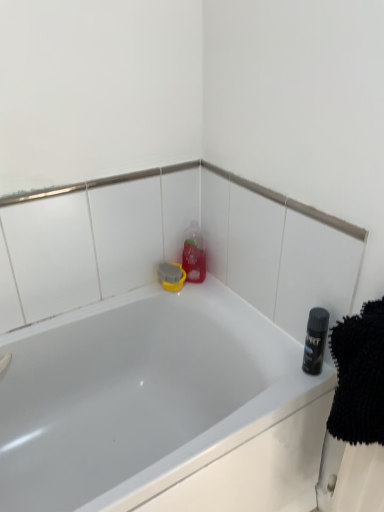
Question: Is shiny black can at right in contact with translucent plastic bottle at upper center?

Choices:
 (A) yes
 (B) no

Answer: (B)

Question: From a real-world perspective, is shiny black can at right over translucent plastic bottle at upper center?

Choices:
 (A) no
 (B) yes

Answer: (A)

Question: Is shiny black can at right smaller than translucent plastic bottle at upper center?

Choices:
 (A) no
 (B) yes

Answer: (B)

Question: From the image's perspective, is shiny black can at right beneath translucent plastic bottle at upper center?

Choices:
 (A) yes
 (B) no

Answer: (A)

Question: Is shiny black can at right facing towards translucent plastic bottle at upper center?

Choices:
 (A) yes
 (B) no

Answer: (B)

Question: From the image's perspective, is white glossy bathtub at center positioned above or below shiny black can at right?

Choices:
 (A) above
 (B) below

Answer: (B)

Question: Is white glossy bathtub at center to the left or to the right of shiny black can at right in the image?

Choices:
 (A) left
 (B) right

Answer: (A)

Question: Relative to shiny black can at right, is white glossy bathtub at center in front or behind?

Choices:
 (A) front
 (B) behind

Answer: (A)

Question: From their relative heights in the image, would you say white glossy bathtub at center is taller or shorter than shiny black can at right?

Choices:
 (A) short
 (B) tall

Answer: (B)

Question: Considering the positions of translucent plastic bottle at upper center and white glossy bathtub at center in the image, is translucent plastic bottle at upper center bigger or smaller than white glossy bathtub at center?

Choices:
 (A) big
 (B) small

Answer: (B)

Question: Looking at their shapes, would you say translucent plastic bottle at upper center is wider or thinner than white glossy bathtub at center?

Choices:
 (A) wide
 (B) thin

Answer: (B)

Question: Based on their positions, is translucent plastic bottle at upper center located to the left or right of white glossy bathtub at center?

Choices:
 (A) left
 (B) right

Answer: (B)

Question: Does point (195, 269) appear closer or farther from the camera than point (48, 345)?

Choices:
 (A) farther
 (B) closer

Answer: (A)

Question: Relative to white glossy bathtub at center, is shiny black can at right in front or behind?

Choices:
 (A) behind
 (B) front

Answer: (A)

Question: Considering the positions of shiny black can at right and white glossy bathtub at center in the image, is shiny black can at right taller or shorter than white glossy bathtub at center?

Choices:
 (A) short
 (B) tall

Answer: (A)